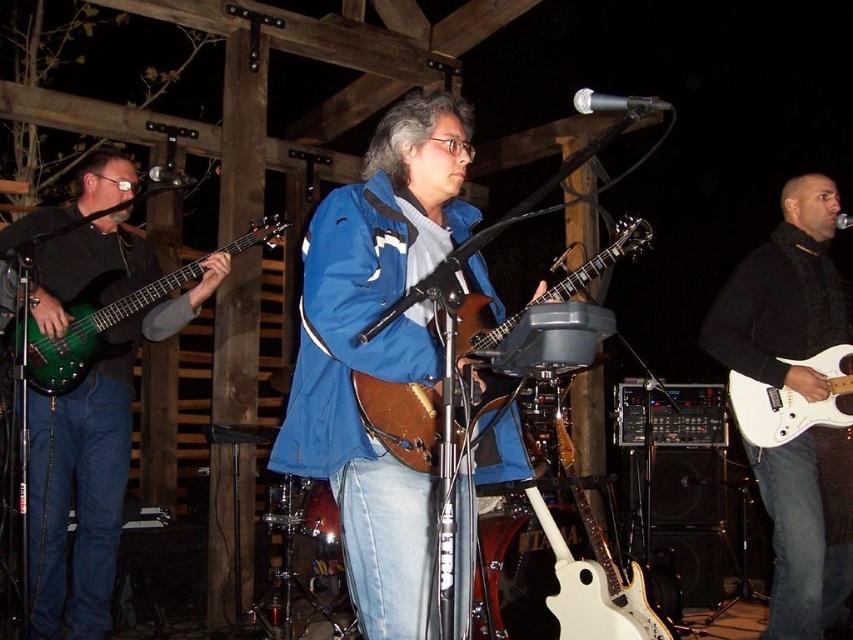
Question: Does matte brown guitar at center appear over brown leather guitar at center?

Choices:
 (A) yes
 (B) no

Answer: (B)

Question: Which object is farther from the camera taking this photo?

Choices:
 (A) green glossy electric guitar at left
 (B) matte brown guitar at center
 (C) green glossy bass guitar at left

Answer: (A)

Question: Among these objects, which one is farthest from the camera?

Choices:
 (A) brown leather guitar at center
 (B) green glossy electric guitar at left

Answer: (B)

Question: Which point is closer to the camera taking this photo?

Choices:
 (A) (793, 282)
 (B) (54, 388)
 (C) (834, 368)

Answer: (C)

Question: Is matte brown guitar at center positioned before white glossy electric guitar at right?

Choices:
 (A) no
 (B) yes

Answer: (B)

Question: In this image, where is green glossy bass guitar at left located relative to white glossy electric guitar at right?

Choices:
 (A) below
 (B) above

Answer: (A)